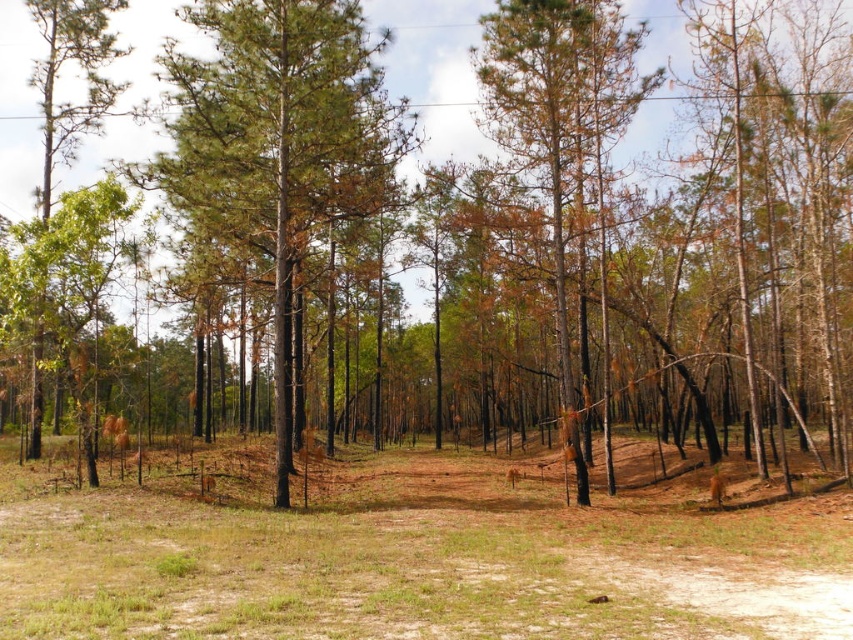
You are planning to plant a new tree in the forest. The brown dirt field at center and the green matte tree at left are both potential locations. Based on their sizes, which location might be more suitable for planting a sapling, and why?

The brown dirt field at center has a smaller size compared to the green matte tree at left. Since the dirt field is smaller, it might offer less space for the sapling to grow roots, making the area around the green matte tree at left a better choice for planting.

You are a hiker who wants to place a 3.30 meter long tent between the brown dirt field at center and the green matte tree at center. Can you fit the tent between them without overlapping either?

The brown dirt field at center is 6.60 meters away from the green matte tree at center. Since the tent is 3.30 meters long, it can fit between them as the distance is twice the tent length, leaving space on both ends.